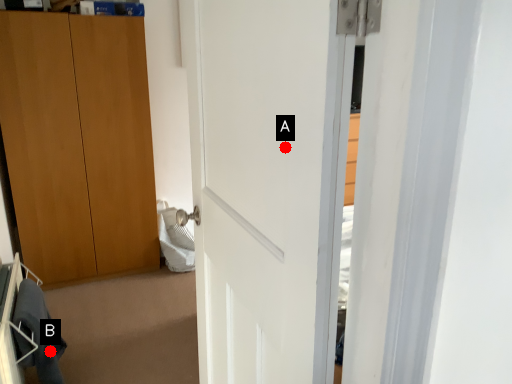
Question: Two points are circled on the image, labeled by A and B beside each circle. Which point is further to the camera?

Choices:
 (A) A is further
 (B) B is further

Answer: (B)